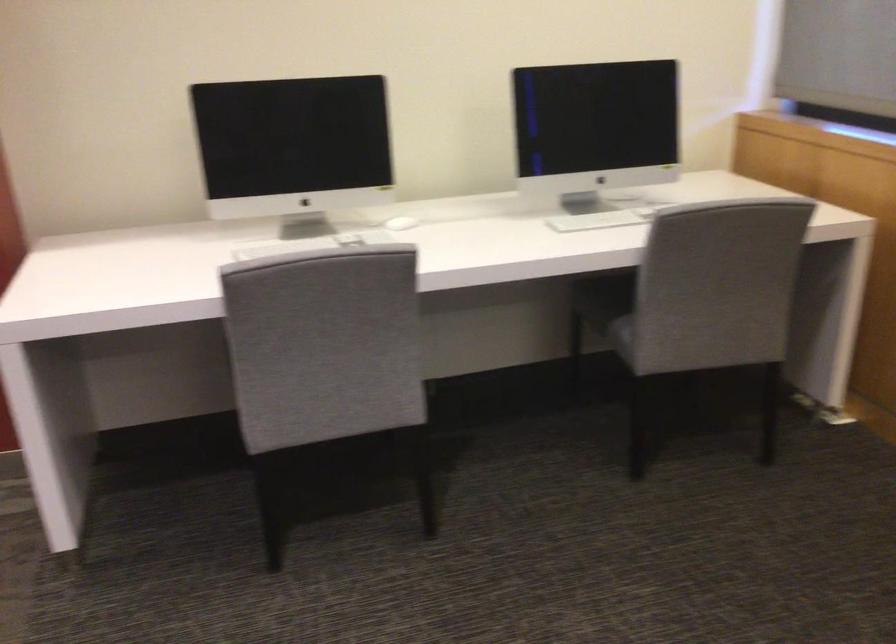
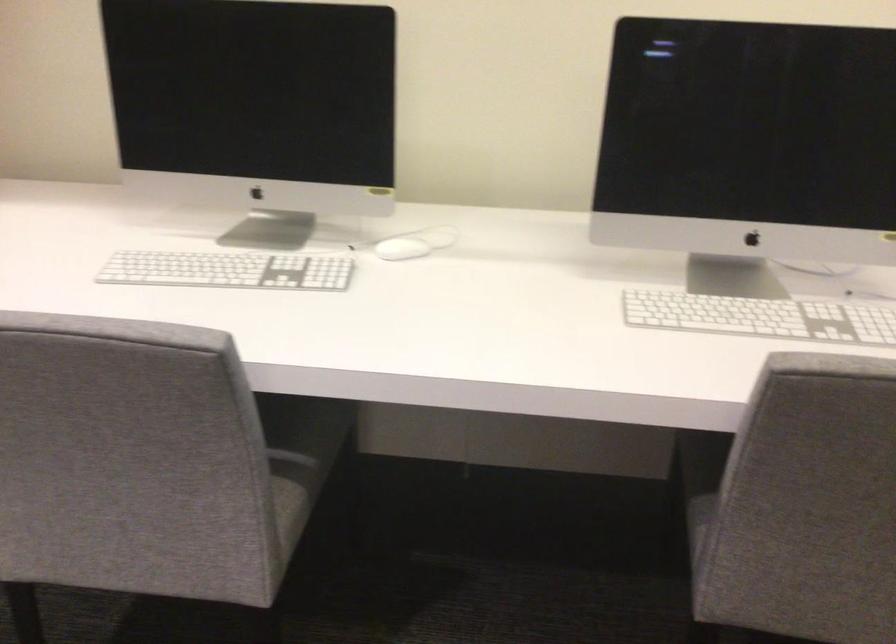
The point at (623, 214) is marked in the first image. Where is the corresponding point in the second image?

(760, 317)